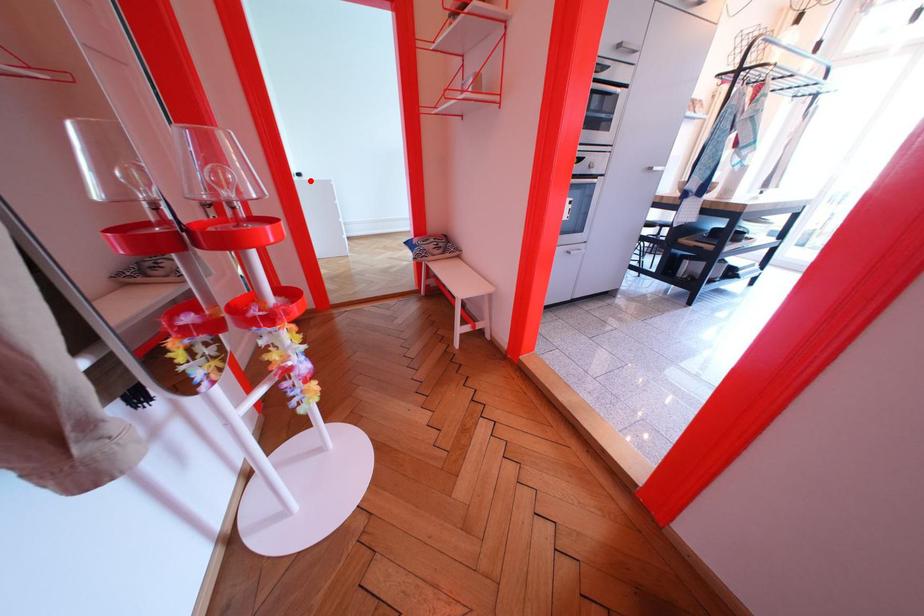
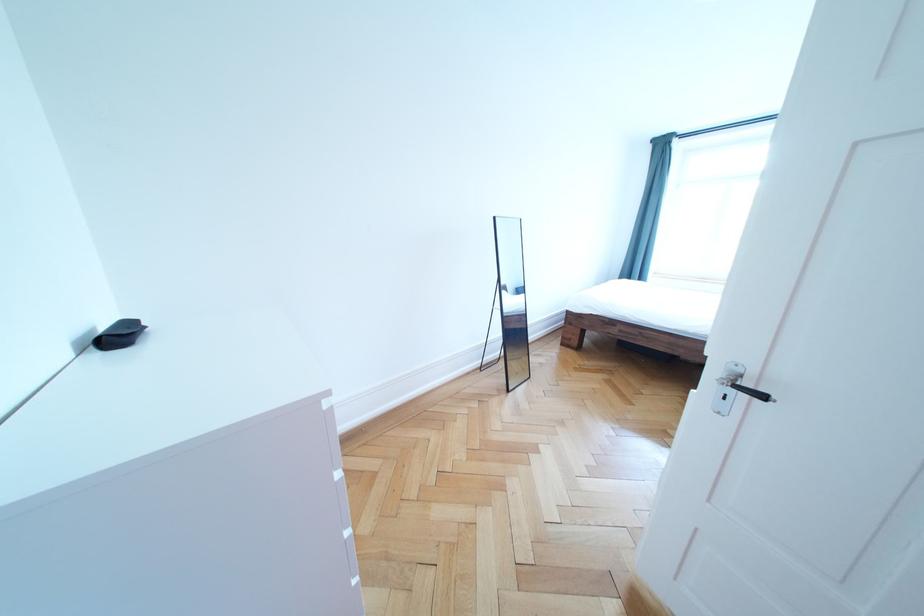
Question: I am providing you with two images of the same scene from different viewpoints. A red point is shown in image1. For the corresponding object point in image2, is it positioned nearer or farther from the camera?

Choices:
 (A) Nearer
 (B) Farther

Answer: (B)